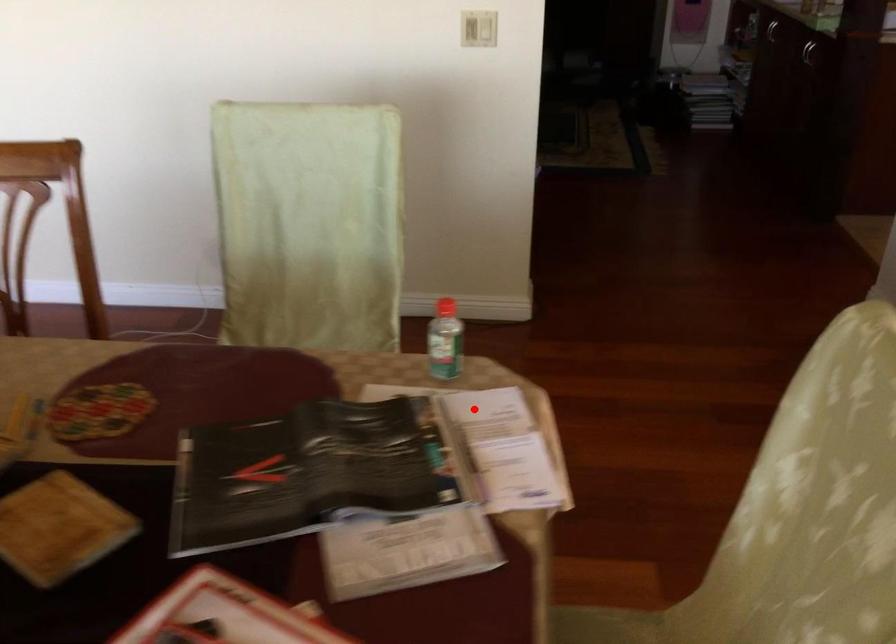
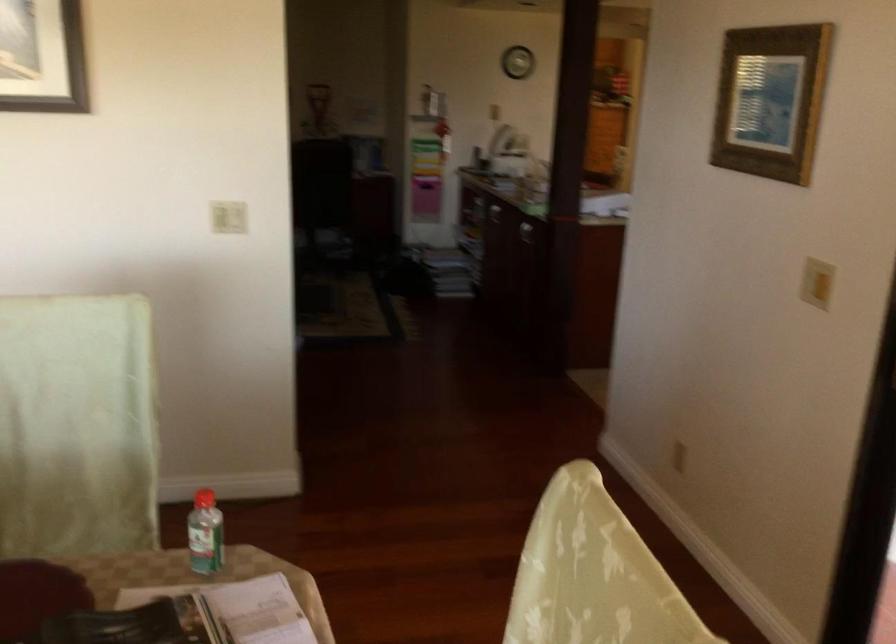
Locate, in the second image, the point that corresponds to the highlighted location in the first image.

(238, 609)